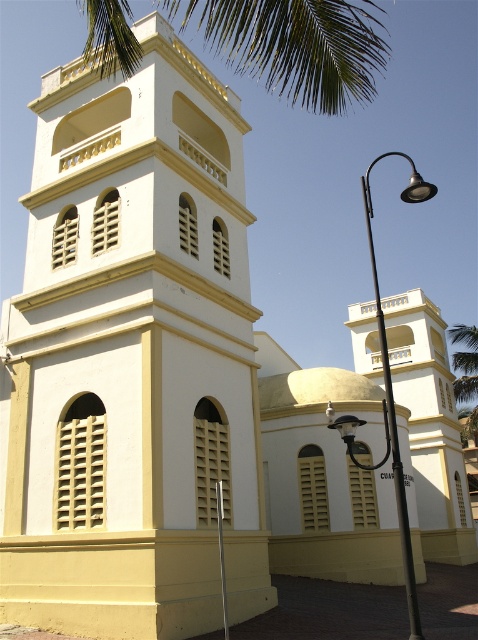
You are standing in front of the building and want to reach the point marked at coordinates point (395, 488). The path to this point is 10 meters long. Can you walk directly to it without needing to detour?

The point (395, 488) is 9.55 meters from the viewer, and the path is 10 meters long, so yes, you can walk directly to it since the path length is sufficient.

You are a city planner assessing the placement of the black metal streetlight at center and the green leafy palm tree at upper right. Considering their heights, which one would cast a longer shadow during midday when the sun is directly overhead?

A: The black metal streetlight at center has a greater height compared to the green leafy palm tree at upper right, so it would cast a longer shadow during midday when the sun is directly overhead.

You are standing at the entrance of the building and want to take a photo of the white matte tower at center. If the camera has a field of view that covers up to a 0.8 coordinate on the x and y axes, will the tower be fully visible in the photo?

The white matte tower at center is located at point 0.666 on the x and 0.902 on the y. Since the camera can cover up to 0.8 on both axes, the tower is beyond the camera field of view on the y axis and will not be fully visible.